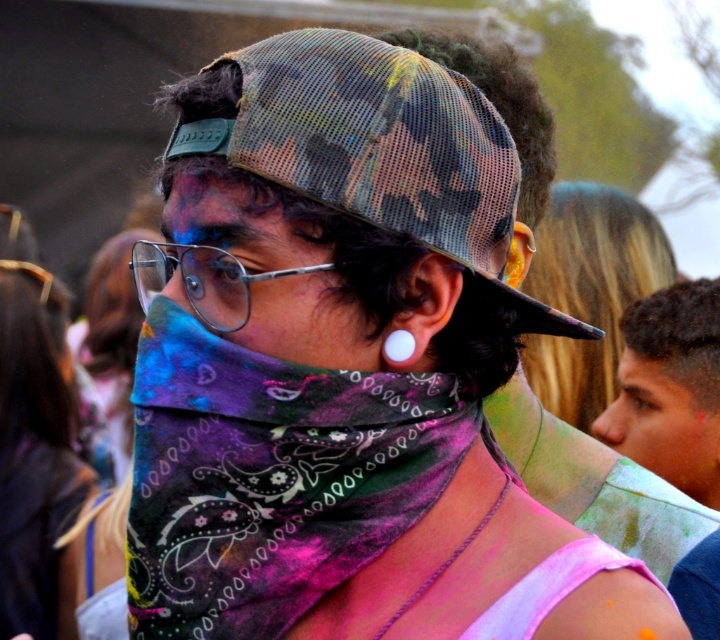
Is smooth skin face at right positioned in front of silver metallic glasses at center?

No, smooth skin face at right is behind silver metallic glasses at center.

Is smooth skin face at right thinner than silver metallic glasses at center?

Indeed, smooth skin face at right has a lesser width compared to silver metallic glasses at center.

Is point (657, 413) farther from viewer compared to point (225, 291)?

That is True.

Image resolution: width=720 pixels, height=640 pixels. What are the coordinates of `smooth skin face at right` in the screenshot? It's located at (662, 428).

Is the position of camo mesh cap at center more distant than that of smooth skin face at right?

No, camo mesh cap at center is closer to the viewer.

Locate an element on the screen. camo mesh cap at center is located at coordinates (386, 147).

Which is behind, point (415, 172) or point (702, 440)?

The point (702, 440) is behind.

You are a GUI agent. You are given a task and a screenshot of the screen. Output one action in this format:
    pyautogui.click(x=<x>, y=<y>)
    Task: Click on the camo mesh cap at center
    
    Given the screenshot: What is the action you would take?
    pyautogui.click(x=386, y=147)

Between camo mesh cap at center and multicolored bandana at center, which one appears on the left side from the viewer's perspective?

From the viewer's perspective, multicolored bandana at center appears more on the left side.

Can you confirm if camo mesh cap at center is taller than multicolored bandana at center?

Yes.

Between point (400, 67) and point (306, 323), which one is positioned in front?

Point (306, 323)

You are a GUI agent. You are given a task and a screenshot of the screen. Output one action in this format:
    pyautogui.click(x=<x>, y=<y>)
    Task: Click on the camo mesh cap at center
    This screenshot has height=640, width=720.
    Given the screenshot: What is the action you would take?
    pyautogui.click(x=386, y=147)